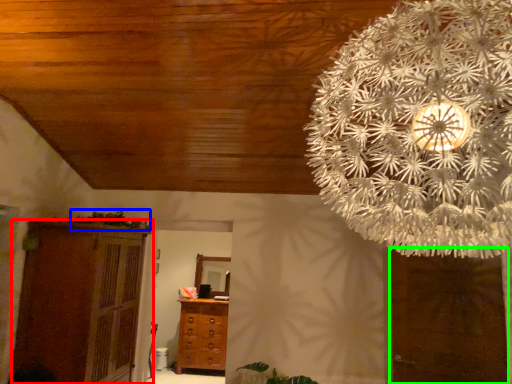
Question: Which is farther away from cupboard (highlighted by a red box)? plant (highlighted by a blue box) or door (highlighted by a green box)?

Choices:
 (A) plant
 (B) door

Answer: (B)